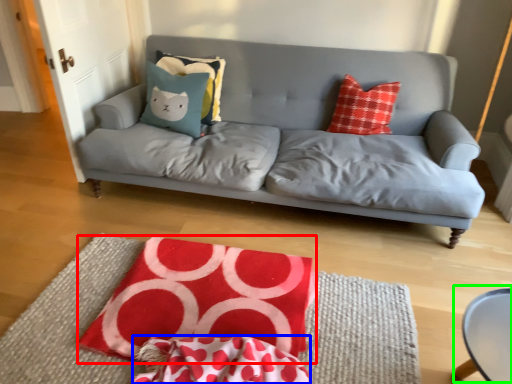
Question: Considering the real-world distances, which object is farthest from quilt (highlighted by a red box)? material (highlighted by a blue box) or round table (highlighted by a green box)?

Choices:
 (A) material
 (B) round table

Answer: (B)